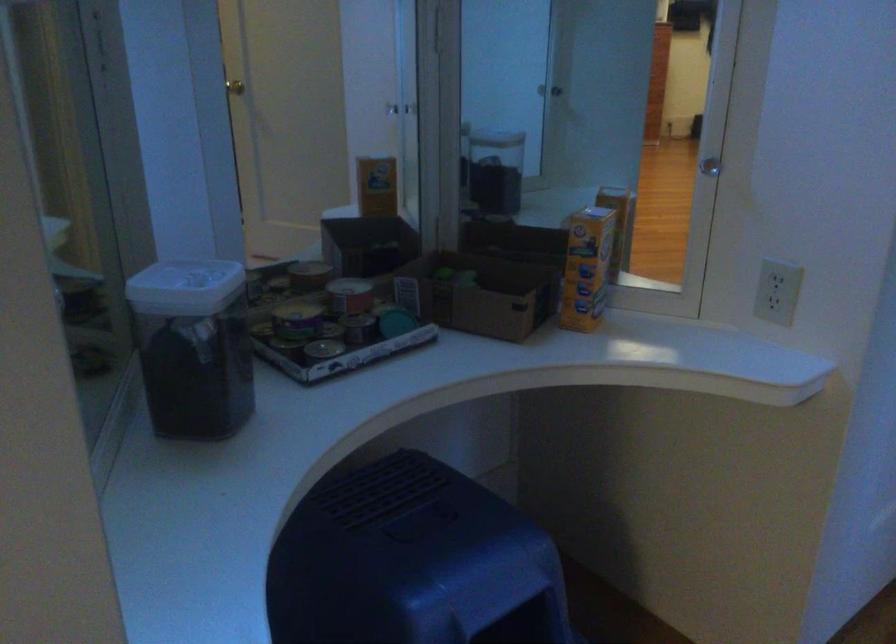
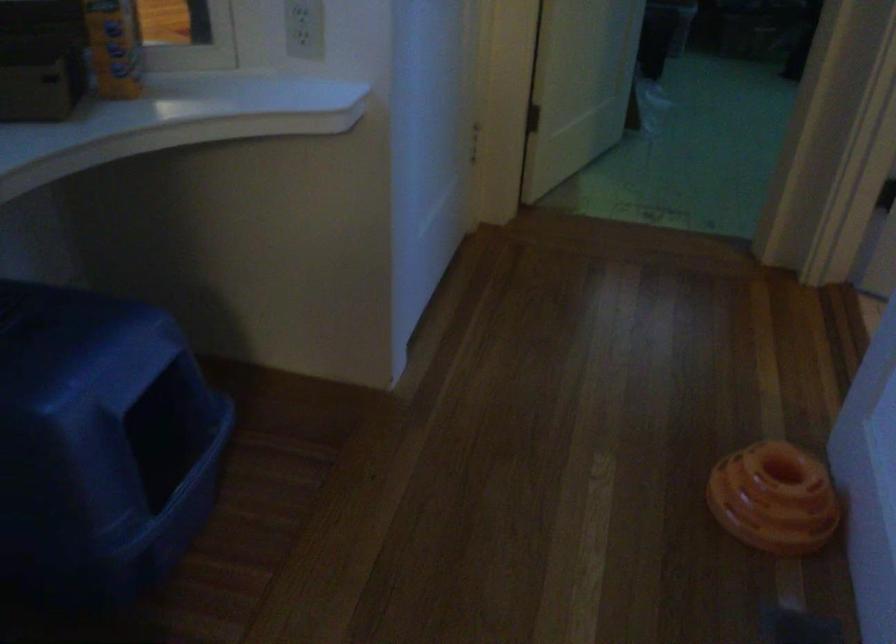
How did the camera likely rotate?

The rotation direction of the camera is right-down.